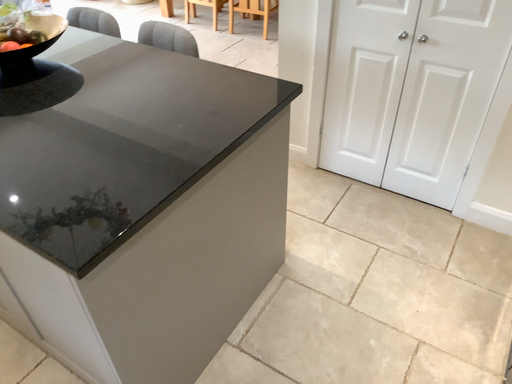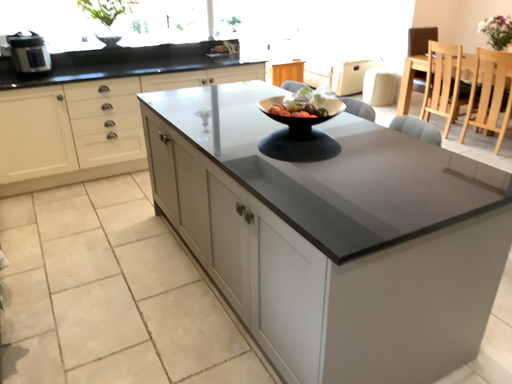
Question: How did the camera likely rotate when shooting the video?

Choices:
 (A) rotated downward
 (B) rotated upward

Answer: (B)